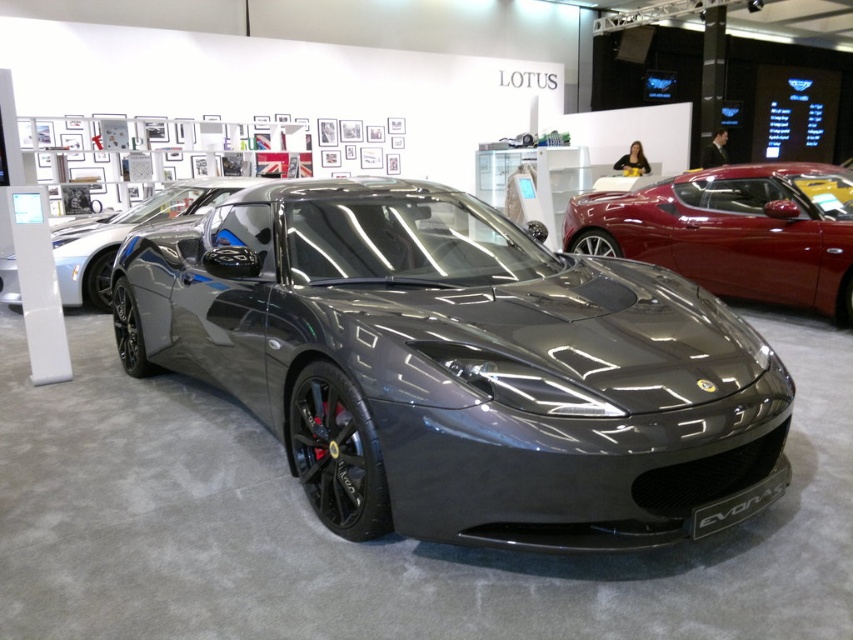
Between satin black sports car at center and glossy metallic sports car at center, which one is positioned higher?

glossy metallic sports car at center is higher up.

Does satin black sports car at center appear on the right side of glossy metallic sports car at center?

Incorrect, satin black sports car at center is not on the right side of glossy metallic sports car at center.

Where is `satin black sports car at center`? satin black sports car at center is located at coordinates (460, 368).